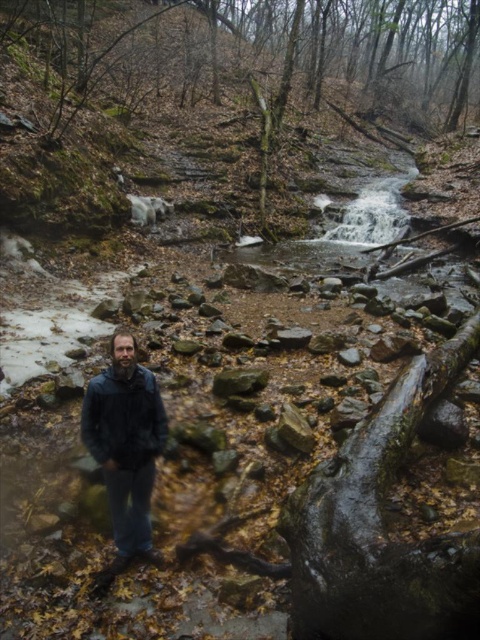
Does brown mossy rocks at center have a greater height compared to dark blue leather jacket at lower left?

Yes.

Does brown mossy rocks at center come behind dark blue leather jacket at lower left?

Yes, brown mossy rocks at center is behind dark blue leather jacket at lower left.

Image resolution: width=480 pixels, height=640 pixels. I want to click on brown mossy rocks at center, so click(x=215, y=90).

Does brown mossy rocks at center lie behind dark blue jacket at center?

Yes, it is behind dark blue jacket at center.

Is brown mossy rocks at center to the right of dark blue jacket at center from the viewer's perspective?

Indeed, brown mossy rocks at center is positioned on the right side of dark blue jacket at center.

Does point (272, 182) lie in front of point (127, 545)?

No.

This screenshot has width=480, height=640. In order to click on brown mossy rocks at center in this screenshot , I will do `click(215, 90)`.

Is dark blue jacket at center closer to the viewer compared to dark blue leather jacket at lower left?

Yes, it is in front of dark blue leather jacket at lower left.

Is dark blue jacket at center further to the viewer compared to dark blue leather jacket at lower left?

No.

This screenshot has width=480, height=640. Find the location of `dark blue jacket at center`. dark blue jacket at center is located at coordinates click(x=126, y=445).